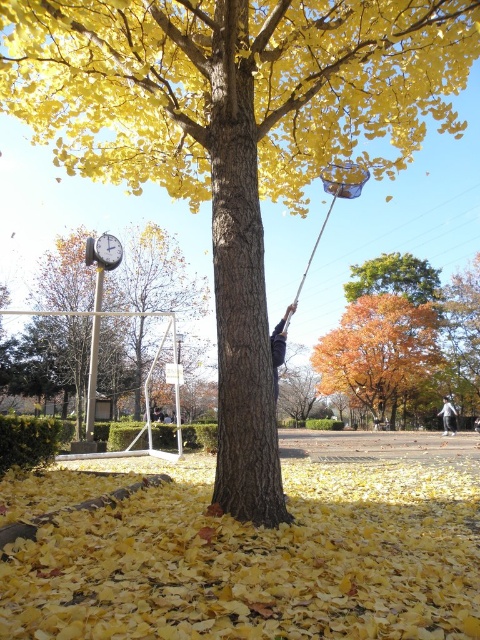
The width and height of the screenshot is (480, 640). Identify the location of metallic gray clock at upper left. (107, 252).

Between smooth yellow leaves at center and dark gray fabric at tree trunk, which one is positioned higher?

Positioned higher is dark gray fabric at tree trunk.

Between point (220, 612) and point (274, 356), which one is positioned in front?

Point (220, 612) is in front.

Image resolution: width=480 pixels, height=640 pixels. In order to click on smooth yellow leaves at center in this screenshot , I will do `click(254, 548)`.

What are the coordinates of `smooth yellow leaves at center` in the screenshot? It's located at point(254,548).

Can you confirm if smooth yellow leaves at center is positioned to the right of orange autumn leaves at center?

In fact, smooth yellow leaves at center is to the left of orange autumn leaves at center.

Is smooth yellow leaves at center below orange autumn leaves at center?

No.

Where is `smooth yellow leaves at center`? smooth yellow leaves at center is located at coordinates (254, 548).

Identify the location of smooth yellow leaves at center. (254, 548).